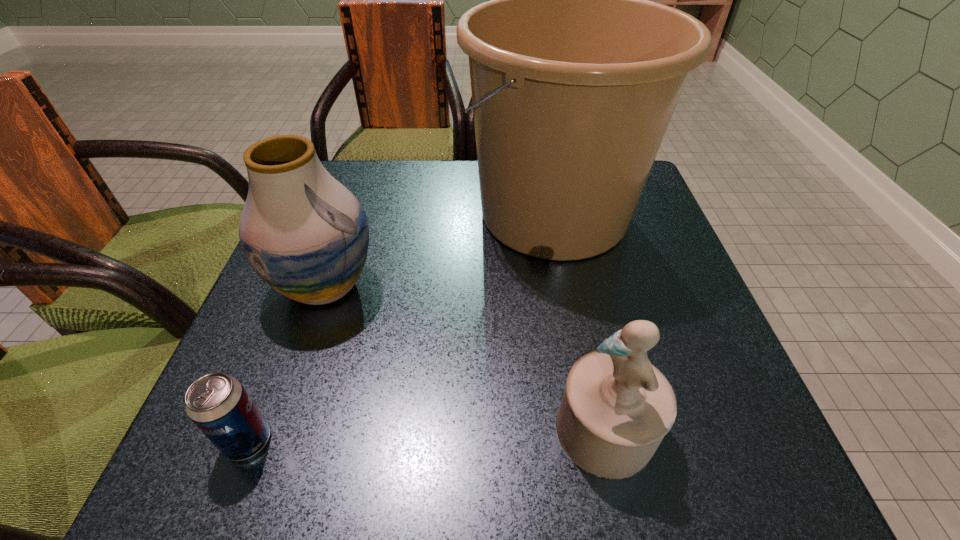
Where is `object that is at the far edge`? The height and width of the screenshot is (540, 960). object that is at the far edge is located at coordinates (575, 75).

Where is `figurine that is positioned at the near edge`? Image resolution: width=960 pixels, height=540 pixels. figurine that is positioned at the near edge is located at coordinates (617, 407).

You are a GUI agent. You are given a task and a screenshot of the screen. Output one action in this format:
    pyautogui.click(x=<x>, y=<y>)
    Task: Click on the beer can that is at the near edge
    The image size is (960, 540).
    Given the screenshot: What is the action you would take?
    pyautogui.click(x=218, y=404)

Find the location of a particular element. The width and height of the screenshot is (960, 540). vase that is positioned at the left edge is located at coordinates (305, 234).

Where is `beer can present at the left edge`? The image size is (960, 540). beer can present at the left edge is located at coordinates (218, 404).

This screenshot has width=960, height=540. What are the coordinates of `bucket that is positioned at the right edge` in the screenshot? It's located at (575, 75).

The image size is (960, 540). Identify the location of figurine at the right edge. (617, 407).

Find the location of a particular element. The width and height of the screenshot is (960, 540). object that is at the near left corner is located at coordinates [218, 404].

Where is `object that is at the far right corner`? object that is at the far right corner is located at coordinates (575, 75).

The image size is (960, 540). Find the location of `object that is positioned at the near right corner`. object that is positioned at the near right corner is located at coordinates 617,407.